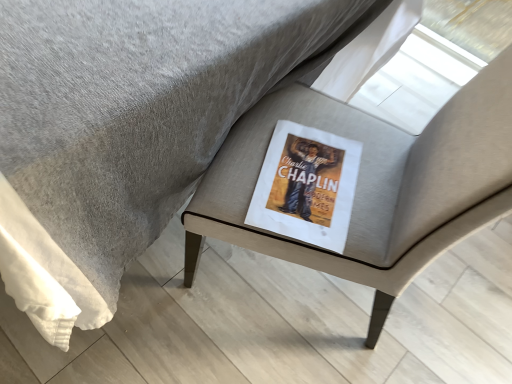
Question: Considering the relative sizes of matte gray cushion at center and matte paper book at center in the image provided, is matte gray cushion at center thinner than matte paper book at center?

Choices:
 (A) yes
 (B) no

Answer: (B)

Question: From a real-world perspective, is matte gray cushion at center beneath matte paper book at center?

Choices:
 (A) no
 (B) yes

Answer: (A)

Question: From a real-world perspective, is matte gray cushion at center positioned over matte paper book at center based on gravity?

Choices:
 (A) yes
 (B) no

Answer: (A)

Question: Is the position of matte gray cushion at center less distant than that of matte paper book at center?

Choices:
 (A) no
 (B) yes

Answer: (B)

Question: Does matte gray cushion at center appear on the right side of matte paper book at center?

Choices:
 (A) no
 (B) yes

Answer: (B)

Question: Considering the relative sizes of matte gray cushion at center and matte paper book at center in the image provided, is matte gray cushion at center smaller than matte paper book at center?

Choices:
 (A) no
 (B) yes

Answer: (A)

Question: Are matte paper book at center and matte gray cushion at center making contact?

Choices:
 (A) no
 (B) yes

Answer: (A)

Question: Is matte paper book at center facing away from matte gray cushion at center?

Choices:
 (A) no
 (B) yes

Answer: (B)

Question: From the image's perspective, is matte paper book at center above matte gray cushion at center?

Choices:
 (A) yes
 (B) no

Answer: (B)

Question: Does matte paper book at center have a smaller size compared to matte gray cushion at center?

Choices:
 (A) yes
 (B) no

Answer: (A)

Question: Would you say matte paper book at center is a long distance from matte gray cushion at center?

Choices:
 (A) no
 (B) yes

Answer: (A)

Question: Could you tell me if matte paper book at center is facing matte gray cushion at center?

Choices:
 (A) yes
 (B) no

Answer: (A)

Question: Is matte gray cushion at center wider or thinner than matte paper book at center?

Choices:
 (A) wide
 (B) thin

Answer: (A)